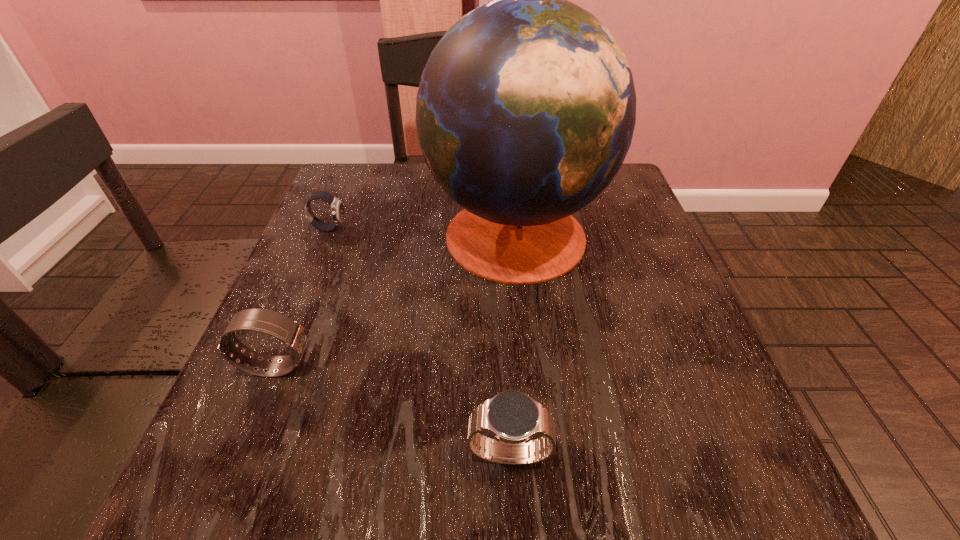
The width and height of the screenshot is (960, 540). I want to click on vacant space at the far left corner, so click(x=329, y=186).

The image size is (960, 540). I want to click on free spot at the far right corner of the desktop, so click(x=615, y=178).

The image size is (960, 540). What are the coordinates of `blank region between the rightmost watch and the second nearest object` in the screenshot? It's located at (393, 410).

This screenshot has height=540, width=960. I want to click on unoccupied area between the second nearest watch and the globe, so click(x=396, y=299).

The height and width of the screenshot is (540, 960). I want to click on free space between the second farthest watch and the shortest watch, so click(302, 297).

At what (x,y) coordinates should I click in order to perform the action: click on empty space between the farthest watch and the rightmost watch. Please return your answer as a coordinate pair (x, y). Looking at the image, I should click on (420, 341).

The height and width of the screenshot is (540, 960). In order to click on empty space between the tallest object and the second nearest watch in this screenshot , I will do `click(396, 299)`.

Where is `vacant space in between the shortest object and the tallest object`? The height and width of the screenshot is (540, 960). vacant space in between the shortest object and the tallest object is located at coordinates (422, 230).

I want to click on free space between the shortest watch and the tallest object, so click(x=422, y=230).

Where is `free space between the globe and the rightmost watch`? The image size is (960, 540). free space between the globe and the rightmost watch is located at coordinates (513, 343).